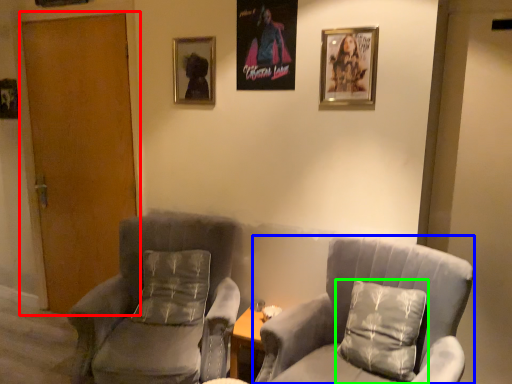
Question: Which object is the closest to the door (highlighted by a red box)? Choose among these: chair (highlighted by a blue box) or pillow (highlighted by a green box).

Choices:
 (A) chair
 (B) pillow

Answer: (A)